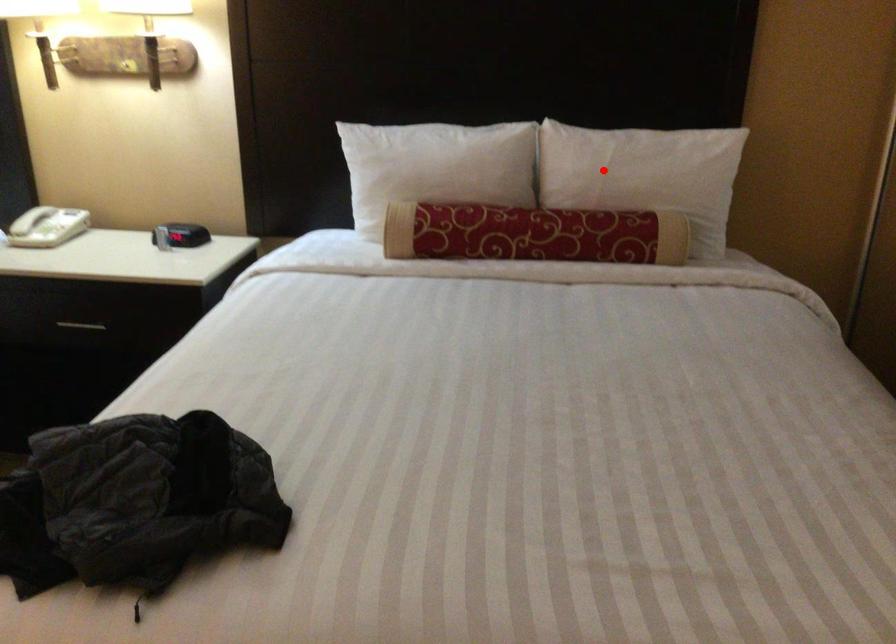
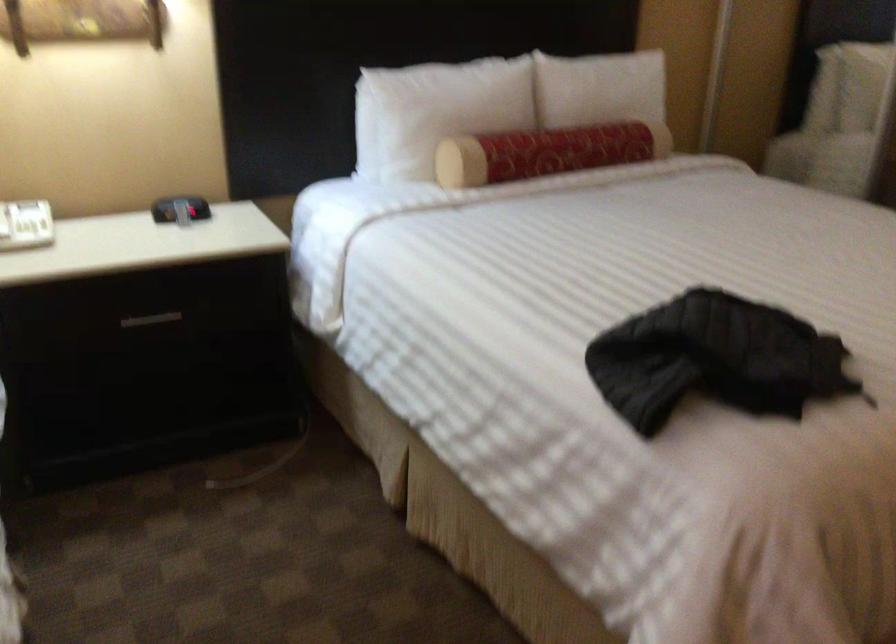
Where in the second image is the point corresponding to the highlighted location from the first image?

(599, 88)